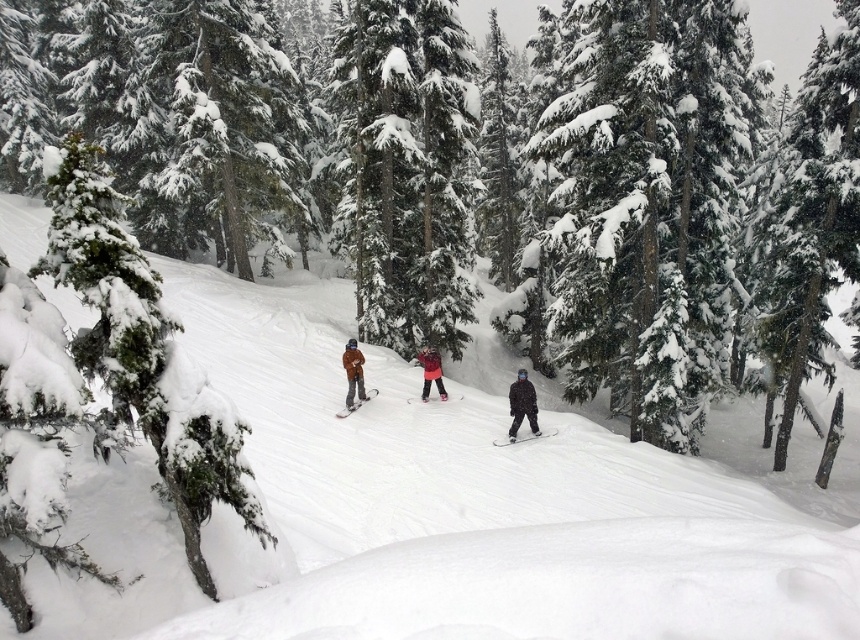
Who is taller, brown matte snowboarder at center or matte black snowboard at center?

With more height is brown matte snowboarder at center.

Based on the photo, can you confirm if brown matte snowboarder at center is positioned below matte black snowboard at center?

No, brown matte snowboarder at center is not below matte black snowboard at center.

Does point (357, 390) come closer to viewer compared to point (345, 406)?

No.

Identify the location of brown matte snowboarder at center. tap(353, 371).

Between point (353, 342) and point (430, 369), which one is positioned behind?

Positioned behind is point (430, 369).

You are a GUI agent. You are given a task and a screenshot of the screen. Output one action in this format:
    pyautogui.click(x=<x>, y=<y>)
    Task: Click on the brown matte snowboarder at center
    
    Given the screenshot: What is the action you would take?
    pyautogui.click(x=353, y=371)

Is dark brown snowsuit at center smaller than black matte ski at center?

Incorrect, dark brown snowsuit at center is not smaller in size than black matte ski at center.

Does point (520, 385) come farther from viewer compared to point (511, 438)?

Yes, point (520, 385) is behind point (511, 438).

Which is behind, point (521, 387) or point (507, 442)?

The point (521, 387) is more distant.

Where is `dark brown snowsuit at center`? dark brown snowsuit at center is located at coordinates (521, 403).